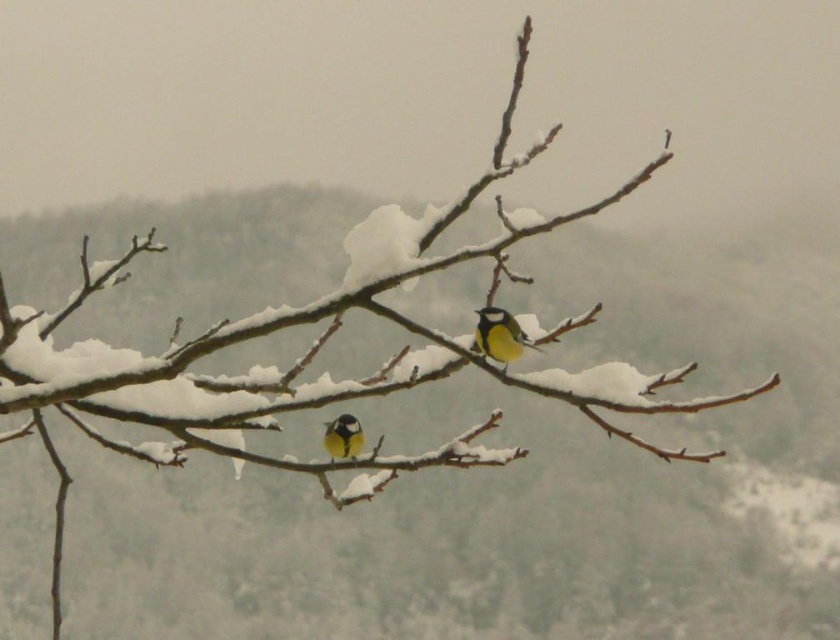
You are standing at the camera position and want to reach the point marked as point (494, 333). If you walk straight ahead, will you reach that point?

Yes, because the point (494, 333) is 11.22 feet away from the camera position, so walking straight ahead will lead you directly to it.